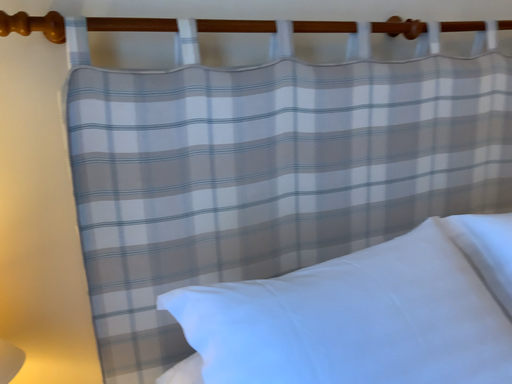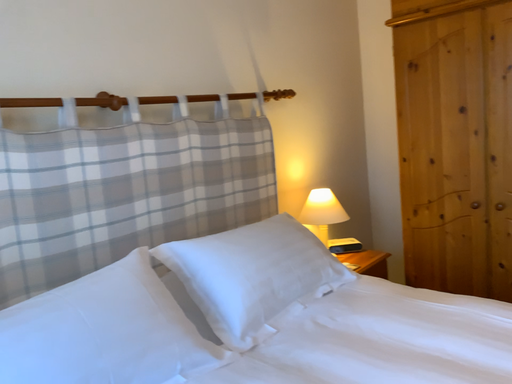
Question: Which way did the camera rotate in the video?

Choices:
 (A) rotated downward
 (B) rotated upward

Answer: (B)